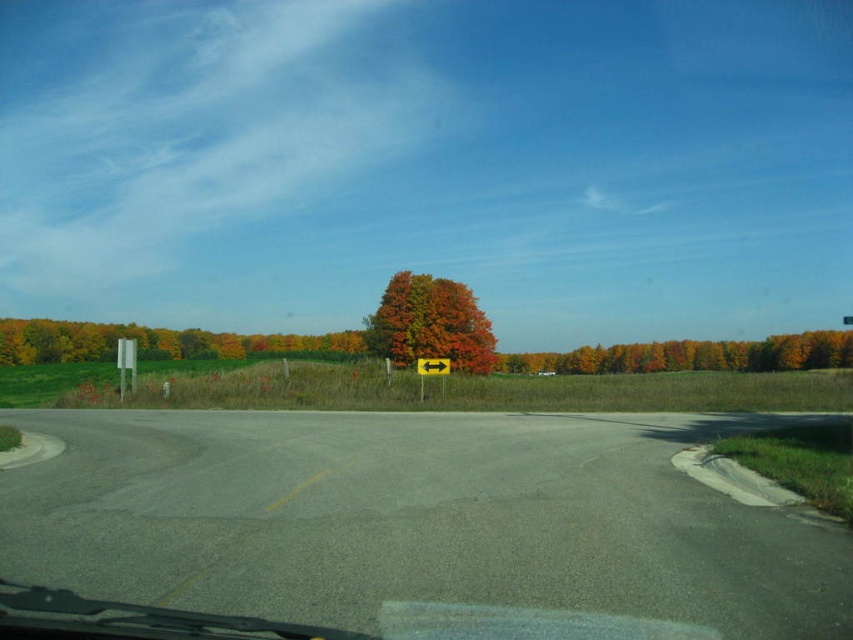
Question: Which object is positioned farthest from the orange matte tree at center?

Choices:
 (A) green matte tree at left
 (B) autumn leaves tree at center
 (C) yellow plastic sign at center

Answer: (C)

Question: Does green matte tree at left lie in front of orange matte tree at center?

Choices:
 (A) no
 (B) yes

Answer: (A)

Question: Which object is the closest to the orange matte tree at center?

Choices:
 (A) autumn leaves tree at center
 (B) green matte tree at left
 (C) yellow plastic sign at center

Answer: (A)

Question: Is green matte tree at left to the right of yellow plastic sign at center from the viewer's perspective?

Choices:
 (A) yes
 (B) no

Answer: (B)

Question: Estimate the real-world distances between objects in this image. Which object is farther from the autumn leaves tree at center?

Choices:
 (A) yellow plastic sign at center
 (B) orange matte tree at center

Answer: (B)

Question: Does green matte tree at left have a greater width compared to autumn leaves tree at center?

Choices:
 (A) no
 (B) yes

Answer: (B)